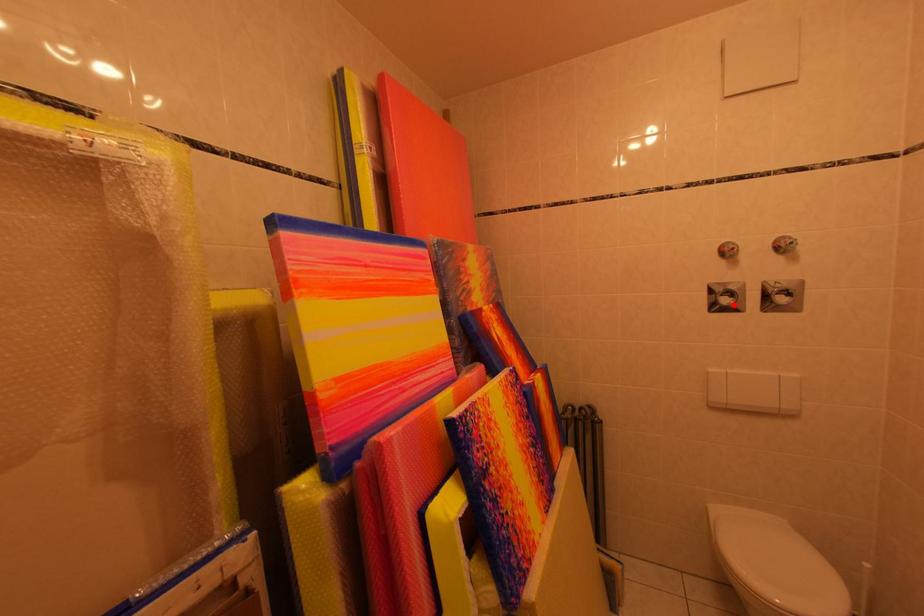
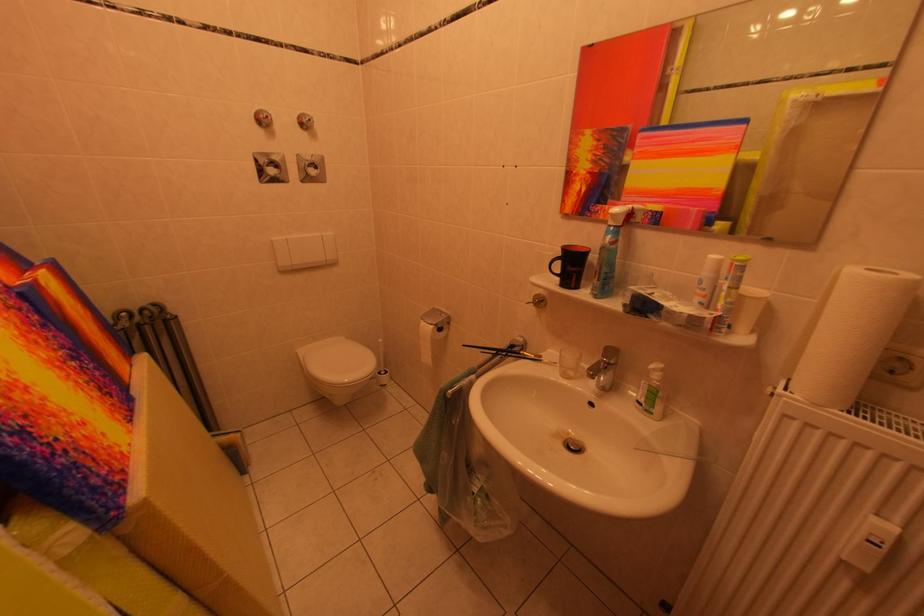
Find the pixel in the second image that matches the highlighted location in the first image.

(282, 175)